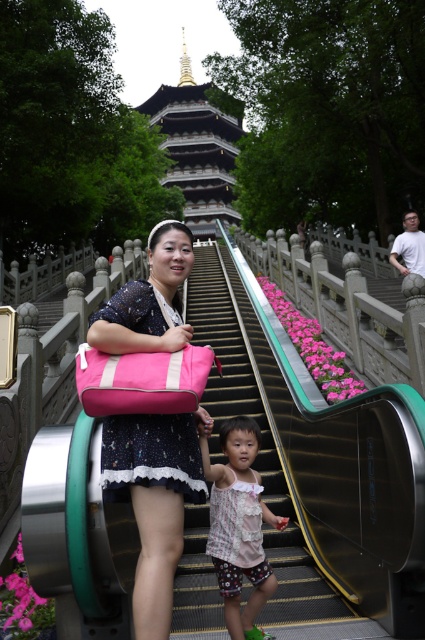
Question: Is metallic escalator at center to the left of light pink fabric dress at center from the viewer's perspective?

Choices:
 (A) yes
 (B) no

Answer: (A)

Question: Which of the following is the closest to the observer?

Choices:
 (A) gold-painted wooden pagoda at upper center
 (B) metallic escalator at center

Answer: (B)

Question: Is light pink fabric dress at center positioned in front of gold-painted wooden pagoda at upper center?

Choices:
 (A) no
 (B) yes

Answer: (B)

Question: Estimate the real-world distances between objects in this image. Which object is closer to the metallic escalator at center?

Choices:
 (A) light pink fabric dress at center
 (B) pink fabric bag at center

Answer: (A)

Question: Is pink fabric bag at center closer to camera compared to light pink fabric dress at center?

Choices:
 (A) yes
 (B) no

Answer: (A)

Question: Which of these objects is positioned farthest from the pink fabric bag at center?

Choices:
 (A) metallic escalator at center
 (B) light pink fabric dress at center
 (C) gold-painted wooden pagoda at upper center

Answer: (C)